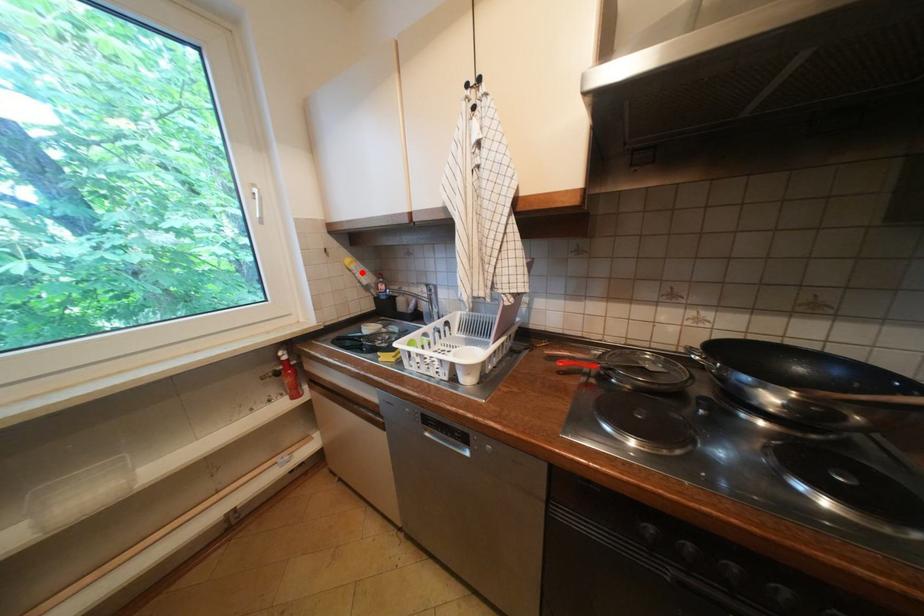
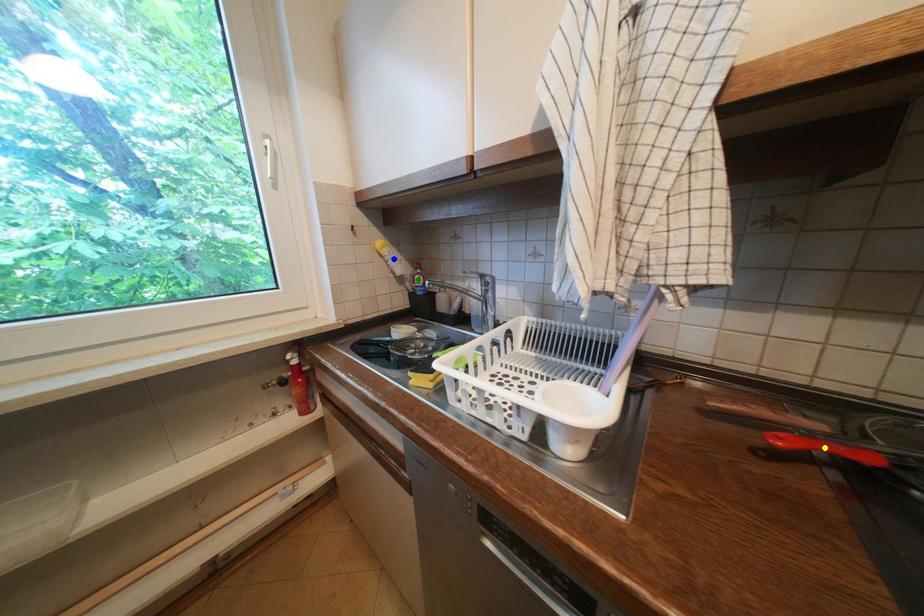
Question: I am providing you with two images of the same scene from different viewpoints. A red point is marked on the first image. You are given multiple points on the second image. Which spot in image 2 lines up with the point in image 1?

Choices:
 (A) yellow point
 (B) green point
 (C) blue point

Answer: (C)